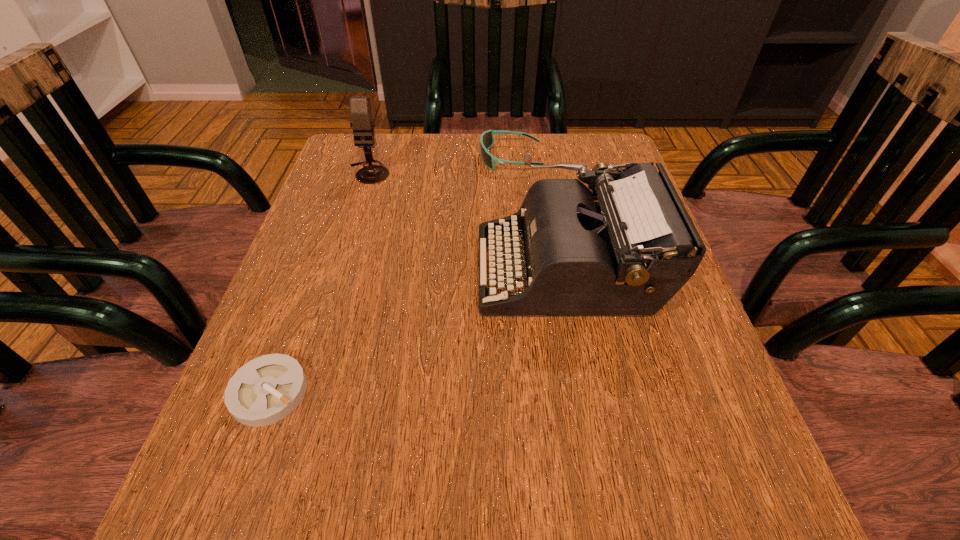
This screenshot has height=540, width=960. I want to click on vacant region located on the front-facing side of the sunglasses, so click(x=420, y=158).

Image resolution: width=960 pixels, height=540 pixels. What are the coordinates of `free point located 0.220m on the front-facing side of the sunglasses` in the screenshot? It's located at (393, 158).

Identify the location of microphone that is at the far edge. The image size is (960, 540). (360, 108).

What are the coordinates of `sunglasses located in the far edge section of the desktop` in the screenshot? It's located at (487, 138).

Locate an element on the screen. The height and width of the screenshot is (540, 960). microphone at the left edge is located at coordinates [x=360, y=108].

The image size is (960, 540). I want to click on ashtray at the left edge, so click(265, 390).

Identify the location of object present at the right edge. This screenshot has height=540, width=960. (626, 248).

Identify the location of object that is at the far left corner. The width and height of the screenshot is (960, 540). (360, 108).

This screenshot has width=960, height=540. Find the location of `free region at the far edge of the desktop`. free region at the far edge of the desktop is located at coordinates (461, 150).

Find the location of `free spot at the near edge of the desktop`. free spot at the near edge of the desktop is located at coordinates (529, 495).